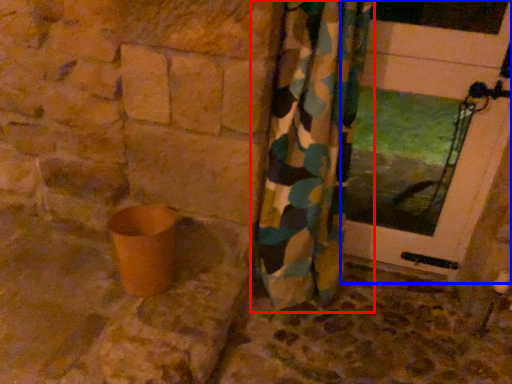
Question: Among these objects, which one is farthest to the camera, curtain (highlighted by a red box) or door (highlighted by a blue box)?

Choices:
 (A) curtain
 (B) door

Answer: (B)